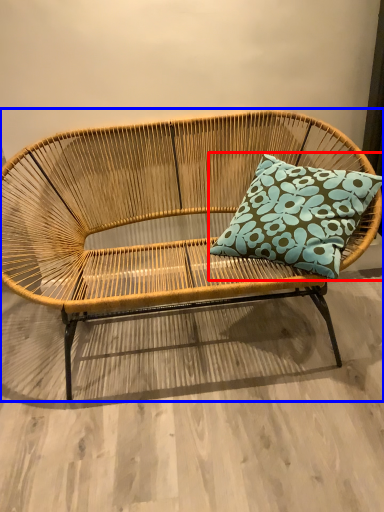
Question: Which of the following is the closest to the observer, pillow (highlighted by a red box) or studio couch (highlighted by a blue box)?

Choices:
 (A) pillow
 (B) studio couch

Answer: (B)